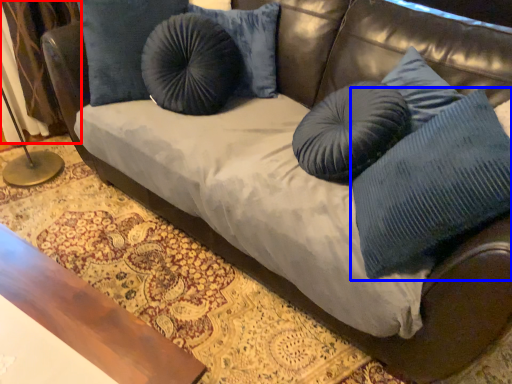
Question: Which point is closer to the camera, curtain (highlighted by a red box) or pillow (highlighted by a blue box)?

Choices:
 (A) curtain
 (B) pillow

Answer: (B)